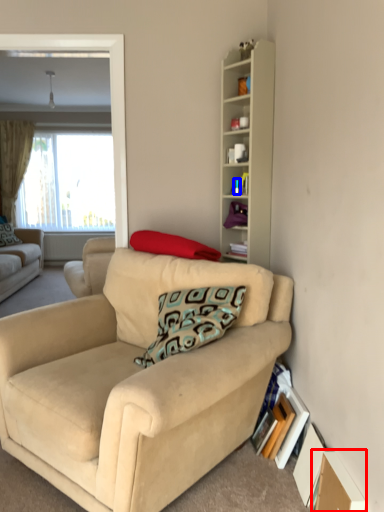
Question: Which object appears closest to the camera in this image, cardboard box (highlighted by a red box) or teal (highlighted by a blue box)?

Choices:
 (A) cardboard box
 (B) teal

Answer: (A)